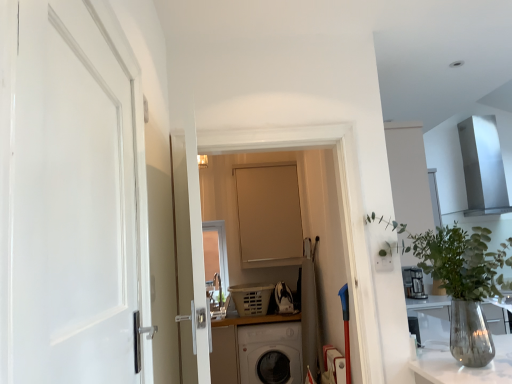
Question: In which direction should I rotate to look at matte beige door at center, the first door viewed from the right?

Choices:
 (A) left
 (B) right

Answer: (B)

Question: From the image's perspective, would you say matte beige door at center, arranged as the first door when viewed from the back, is positioned over white matte door at left, the second door positioned from the right?

Choices:
 (A) yes
 (B) no

Answer: (B)

Question: From a real-world perspective, is matte beige door at center, the 2th door in the front-to-back sequence, physically above white matte door at left, the 1th door when ordered from front to back?

Choices:
 (A) yes
 (B) no

Answer: (A)

Question: Is matte beige door at center, the second door when ordered from left to right, turned away from white matte door at left, which appears as the first door when viewed from the left?

Choices:
 (A) yes
 (B) no

Answer: (B)

Question: From a real-world perspective, is matte beige door at center, the 2th door in the front-to-back sequence, positioned under white matte door at left, the 1th door when ordered from front to back, based on gravity?

Choices:
 (A) no
 (B) yes

Answer: (A)

Question: Is matte beige door at center, arranged as the first door when viewed from the back, aimed at white matte door at left, which is the second door from back to front?

Choices:
 (A) yes
 (B) no

Answer: (A)

Question: Does matte beige door at center, the 2th door in the front-to-back sequence, have a greater height compared to white matte door at left, the 1th door when ordered from front to back?

Choices:
 (A) no
 (B) yes

Answer: (B)

Question: Considering the relative positions of matte beige door at center, the 2th door in the front-to-back sequence, and clear glass vase at right in the image provided, is matte beige door at center, the 2th door in the front-to-back sequence, in front of clear glass vase at right?

Choices:
 (A) no
 (B) yes

Answer: (A)

Question: Is matte beige door at center, the first door viewed from the right, facing away from clear glass vase at right?

Choices:
 (A) yes
 (B) no

Answer: (B)

Question: Can you confirm if matte beige door at center, the 2th door in the front-to-back sequence, is taller than clear glass vase at right?

Choices:
 (A) yes
 (B) no

Answer: (A)

Question: Is matte beige door at center, arranged as the first door when viewed from the back, at the right side of clear glass vase at right?

Choices:
 (A) yes
 (B) no

Answer: (B)

Question: From a real-world perspective, is matte beige door at center, the first door viewed from the right, below clear glass vase at right?

Choices:
 (A) no
 (B) yes

Answer: (A)

Question: Is matte beige door at center, the second door when ordered from left to right, not inside clear glass vase at right?

Choices:
 (A) yes
 (B) no

Answer: (A)

Question: From a real-world perspective, is clear glass vase at right beneath matte beige door at center, arranged as the first door when viewed from the back?

Choices:
 (A) no
 (B) yes

Answer: (B)